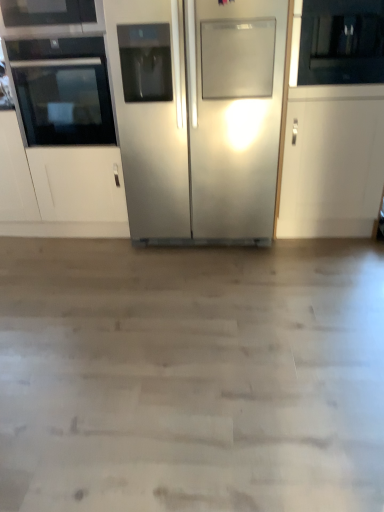
Question: In the image, is black glass oven at left positioned in front of or behind stainless steel refrigerator at center?

Choices:
 (A) front
 (B) behind

Answer: (B)

Question: From the image's perspective, is black glass oven at left positioned above or below stainless steel refrigerator at center?

Choices:
 (A) below
 (B) above

Answer: (B)

Question: In terms of height, does black glass oven at left look taller or shorter compared to stainless steel refrigerator at center?

Choices:
 (A) short
 (B) tall

Answer: (A)

Question: Considering the positions of point (185, 207) and point (51, 134), is point (185, 207) closer or farther from the camera than point (51, 134)?

Choices:
 (A) closer
 (B) farther

Answer: (B)

Question: Is stainless steel refrigerator at center in front of or behind black glass oven at left in the image?

Choices:
 (A) behind
 (B) front

Answer: (B)

Question: Would you say stainless steel refrigerator at center is to the left or to the right of black glass oven at left in the picture?

Choices:
 (A) left
 (B) right

Answer: (B)

Question: Is stainless steel refrigerator at center wider or thinner than black glass oven at left?

Choices:
 (A) thin
 (B) wide

Answer: (B)